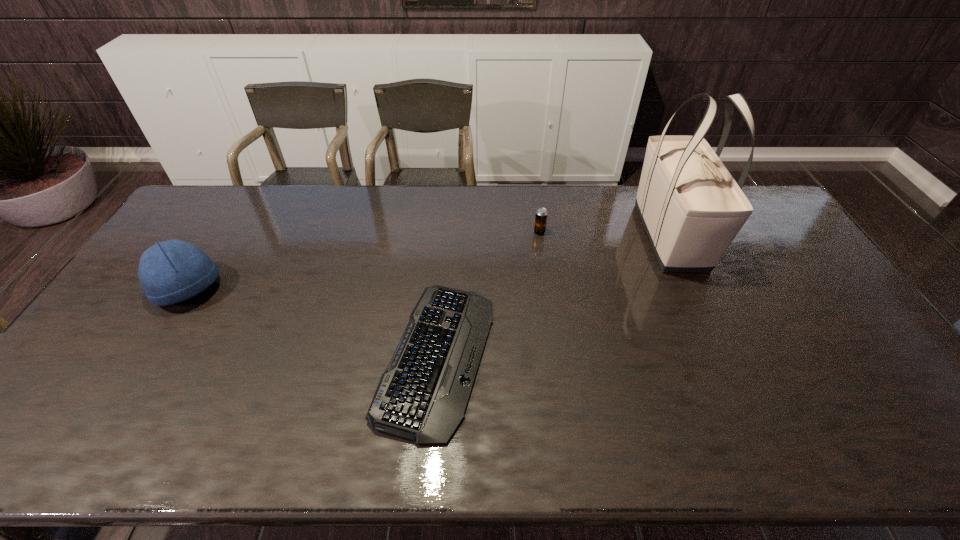
Where is `shopping bag`? The image size is (960, 540). shopping bag is located at coordinates (691, 207).

I want to click on the tallest object, so click(691, 207).

In order to click on the third shortest object in this screenshot , I will do `click(172, 271)`.

The image size is (960, 540). In order to click on the leftmost object in this screenshot , I will do `click(172, 271)`.

Locate an element on the screen. the third tallest object is located at coordinates (541, 214).

Locate an element on the screen. The width and height of the screenshot is (960, 540). the second object from right to left is located at coordinates (541, 214).

Locate an element on the screen. the shortest object is located at coordinates (422, 396).

The height and width of the screenshot is (540, 960). In order to click on computer keyboard in this screenshot , I will do `click(422, 396)`.

The width and height of the screenshot is (960, 540). In order to click on free space located with handles facing forward on the tallest object in this screenshot , I will do `click(711, 327)`.

This screenshot has width=960, height=540. I want to click on vacant area situated 0.330m on the right of the leftmost object, so click(x=332, y=289).